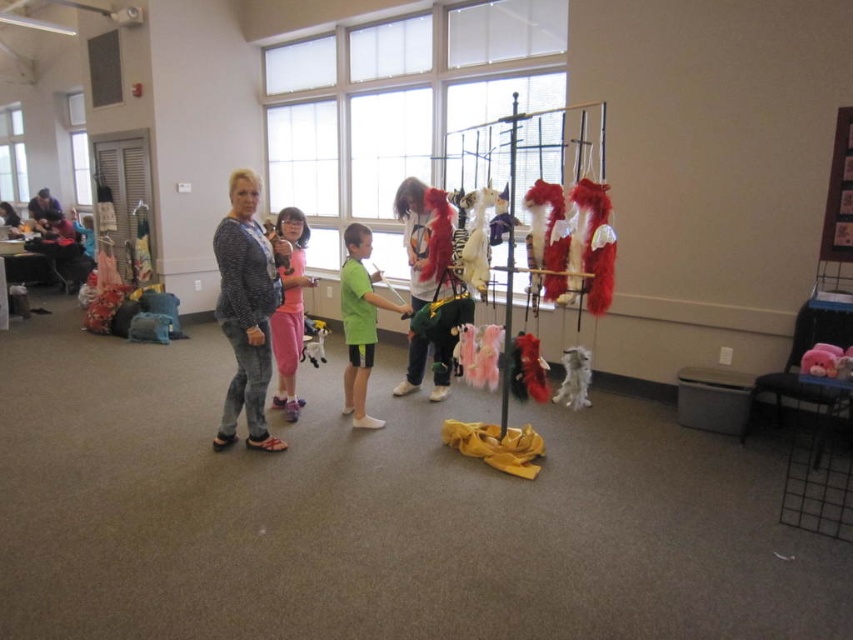
Is pink cotton dress at center to the left of white fluffy dog at center from the viewer's perspective?

Correct, you'll find pink cotton dress at center to the left of white fluffy dog at center.

Is pink cotton dress at center thinner than white fluffy dog at center?

No.

In order to click on pink cotton dress at center in this screenshot , I will do `click(289, 310)`.

Based on the photo, is green matte shirt at center thinner than pink plush toy at lower right?

Incorrect, green matte shirt at center's width is not less than pink plush toy at lower right's.

Between green matte shirt at center and pink plush toy at lower right, which one has less height?

With less height is pink plush toy at lower right.

Which is in front, point (363, 412) or point (846, 364)?

Point (846, 364) is more forward.

The image size is (853, 640). In order to click on green matte shirt at center in this screenshot , I will do `click(360, 323)`.

Is pink cotton dress at center taller than pink plush toy at lower right?

Correct, pink cotton dress at center is much taller as pink plush toy at lower right.

Between pink cotton dress at center and pink plush toy at lower right, which one has less height?

pink plush toy at lower right

Does point (297, 301) lie in front of point (817, 372)?

No.

Find the location of a particular element. pink cotton dress at center is located at coordinates (289, 310).